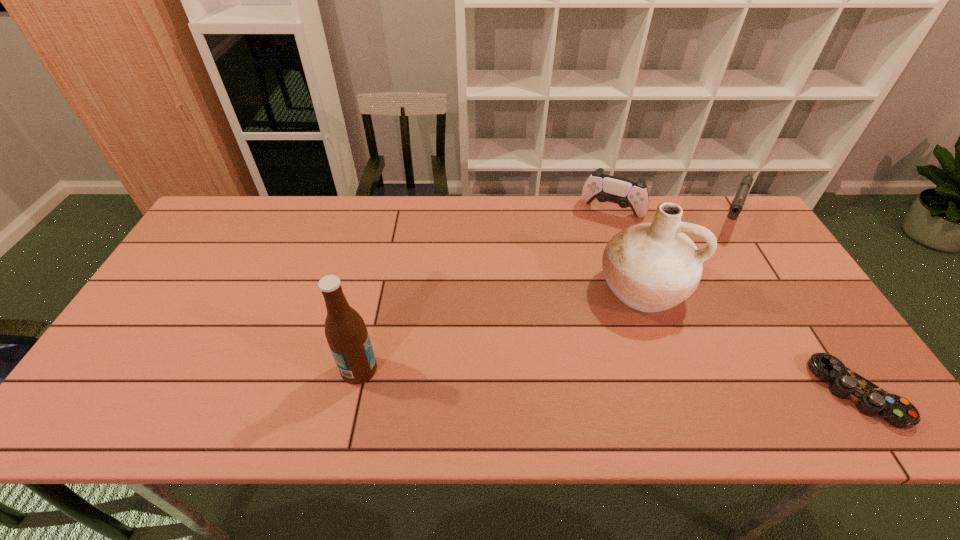
Find the location of `vacant space that's between the beer bottle and the gun`. vacant space that's between the beer bottle and the gun is located at coordinates (544, 295).

This screenshot has height=540, width=960. In order to click on vacant area that lies between the shorter control and the farther control in this screenshot , I will do `click(734, 302)`.

This screenshot has width=960, height=540. I want to click on free space between the shortest object and the gun, so click(x=793, y=306).

Locate an element on the screen. This screenshot has height=540, width=960. empty space between the taller control and the leftmost object is located at coordinates (486, 291).

This screenshot has width=960, height=540. Find the location of `empty space between the beer bottle and the third farthest object`. empty space between the beer bottle and the third farthest object is located at coordinates (500, 329).

Locate an element on the screen. This screenshot has width=960, height=540. unoccupied position between the shorter control and the left control is located at coordinates (734, 302).

The width and height of the screenshot is (960, 540). Find the location of `free space between the gun and the shortest object`. free space between the gun and the shortest object is located at coordinates (793, 306).

Identify the location of empty space that is in between the gun and the leftmost object. Image resolution: width=960 pixels, height=540 pixels. (544, 295).

This screenshot has height=540, width=960. I want to click on object that is the closest to the gun, so click(650, 267).

Select which object appears as the fourth closest to the farther control. Please provide its 2D coordinates. Your answer should be formatted as a tuple, i.e. [(x, y)], where the tuple contains the x and y coordinates of a point satisfying the conditions above.

[(346, 333)]